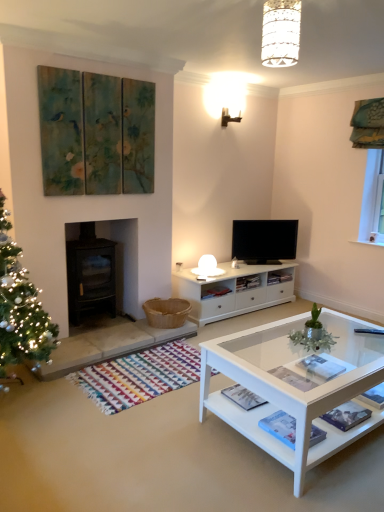
What do you see at coordinates (102, 273) in the screenshot? I see `black glass fireplace at left` at bounding box center [102, 273].

This screenshot has width=384, height=512. What do you see at coordinates (264, 240) in the screenshot?
I see `flat screen tv at center` at bounding box center [264, 240].

What are the coordinates of `flat screen tv at center` in the screenshot? It's located at (264, 240).

I want to click on white textured lampshade at upper center, so click(x=281, y=33).

Is flat screen tv at center not near black glass fireplace at left?

Yes, flat screen tv at center is far from black glass fireplace at left.

Considering their positions, is flat screen tv at center located in front of or behind black glass fireplace at left?

flat screen tv at center is behind black glass fireplace at left.

Consider the image. How different are the orientations of flat screen tv at center and black glass fireplace at left in degrees?

The facing directions of flat screen tv at center and black glass fireplace at left are 29.9 degrees apart.

Is point (279, 230) in front of point (85, 250)?

No, (279, 230) is behind (85, 250).

From the image's perspective, who appears lower, white glass coffee table at lower right or white textured lampshade at upper center?

white glass coffee table at lower right, from the image's perspective.

Does point (315, 447) lie behind point (285, 22)?

Yes, point (315, 447) is behind point (285, 22).

Considering the relative sizes of white glass coffee table at lower right and white textured lampshade at upper center in the image provided, is white glass coffee table at lower right bigger than white textured lampshade at upper center?

Yes, white glass coffee table at lower right is bigger than white textured lampshade at upper center.

Measure the distance from white glass coffee table at lower right to white textured lampshade at upper center.

white glass coffee table at lower right and white textured lampshade at upper center are 5.67 feet apart.

Find the location of a particular element. television below the white textured lampshade at upper center (from a real-world perspective) is located at coordinates (264, 240).

Between white textured lampshade at upper center and flat screen tv at center, which one has more height?

flat screen tv at center.

Based on the photo, from the image's perspective, between white textured lampshade at upper center and flat screen tv at center, which one is located above?

From the image's view, white textured lampshade at upper center is above.

Between white textured lampshade at upper center and flat screen tv at center, which one has larger width?

white textured lampshade at upper center is wider.

Can you confirm if flat screen tv at center is thinner than white textured lampshade at upper center?

Indeed, flat screen tv at center has a lesser width compared to white textured lampshade at upper center.

Considering the relative positions of flat screen tv at center and white textured lampshade at upper center in the image provided, is flat screen tv at center to the left of white textured lampshade at upper center from the viewer's perspective?

In fact, flat screen tv at center is to the right of white textured lampshade at upper center.

From the image's perspective, which object appears higher, flat screen tv at center or white textured lampshade at upper center?

white textured lampshade at upper center, from the image's perspective.

Is flat screen tv at center positioned in front of white textured lampshade at upper center?

No, flat screen tv at center is behind white textured lampshade at upper center.

Which object is closer to the camera, white textured lampshade at upper center or black glass fireplace at left?

white textured lampshade at upper center is in front.

Is white textured lampshade at upper center inside the boundaries of black glass fireplace at left, or outside?

white textured lampshade at upper center is not enclosed by black glass fireplace at left.

Looking at this image, can you tell me how much white textured lampshade at upper center and black glass fireplace at left differ in facing direction?

104 degrees.

From their relative heights in the image, would you say white textured lampshade at upper center is taller or shorter than black glass fireplace at left?

Clearly, white textured lampshade at upper center is shorter compared to black glass fireplace at left.

Is flat screen tv at center bigger or smaller than white glass coffee table at lower right?

In the image, flat screen tv at center appears to be smaller than white glass coffee table at lower right.

Considering the positions of objects flat screen tv at center and white glass coffee table at lower right in the image provided, who is more to the right, flat screen tv at center or white glass coffee table at lower right?

white glass coffee table at lower right.

The width and height of the screenshot is (384, 512). What are the coordinates of `coffee table that is in front of the flat screen tv at center` in the screenshot? It's located at pyautogui.click(x=292, y=385).

From the image's perspective, who appears lower, black glass fireplace at left or white glass coffee table at lower right?

white glass coffee table at lower right.

Does black glass fireplace at left touch white glass coffee table at lower right?

black glass fireplace at left and white glass coffee table at lower right are clearly separated.

Consider the image. Visually, is black glass fireplace at left positioned to the left or to the right of white glass coffee table at lower right?

Based on their positions, black glass fireplace at left is located to the left of white glass coffee table at lower right.

Is white glass coffee table at lower right at the back of black glass fireplace at left?

black glass fireplace at left is not turned away from white glass coffee table at lower right.

Find the location of a particular element. fireplace on the left of the flat screen tv at center is located at coordinates (102, 273).

At what (x,y) coordinates should I click in order to perform the action: click on lamp located behind the white glass coffee table at lower right. Please return your answer as a coordinate pair (x, y). Image resolution: width=384 pixels, height=512 pixels. Looking at the image, I should click on (281, 33).

From the image, which object appears to be farther from white glass coffee table at lower right, black glass fireplace at left or flat screen tv at center?

flat screen tv at center lies further to white glass coffee table at lower right than the other object.

From the image, which object appears to be farther from black glass fireplace at left, white glass coffee table at lower right or flat screen tv at center?

flat screen tv at center.

Estimate the real-world distances between objects in this image. Which object is closer to black glass fireplace at left, white textured lampshade at upper center or white glass coffee table at lower right?

Based on the image, white glass coffee table at lower right appears to be nearer to black glass fireplace at left.

Which object lies further to the anchor point black glass fireplace at left, white glass coffee table at lower right or white textured lampshade at upper center?

white textured lampshade at upper center is further to black glass fireplace at left.

Which object lies further to the anchor point white glass coffee table at lower right, white textured lampshade at upper center or flat screen tv at center?

Among the two, flat screen tv at center is located further to white glass coffee table at lower right.

From the image, which object appears to be farther from flat screen tv at center, white textured lampshade at upper center or black glass fireplace at left?

Among the two, white textured lampshade at upper center is located further to flat screen tv at center.

Looking at the image, which one is located closer to black glass fireplace at left, flat screen tv at center or white glass coffee table at lower right?

The object closer to black glass fireplace at left is white glass coffee table at lower right.

When comparing their distances from white textured lampshade at upper center, does black glass fireplace at left or flat screen tv at center seem further?

flat screen tv at center lies further to white textured lampshade at upper center than the other object.

In order to click on fireplace between white textured lampshade at upper center and flat screen tv at center from front to back in this screenshot , I will do click(102, 273).

Find the location of `lamp positioned between white glass coffee table at lower right and flat screen tv at center from near to far`. lamp positioned between white glass coffee table at lower right and flat screen tv at center from near to far is located at coordinates (281, 33).

At what (x,y) coordinates should I click in order to perform the action: click on fireplace between white glass coffee table at lower right and flat screen tv at center in the front-back direction. Please return your answer as a coordinate pair (x, y). Image resolution: width=384 pixels, height=512 pixels. Looking at the image, I should click on (102, 273).

Find the location of a particular element. lamp between white glass coffee table at lower right and black glass fireplace at left along the z-axis is located at coordinates (281, 33).